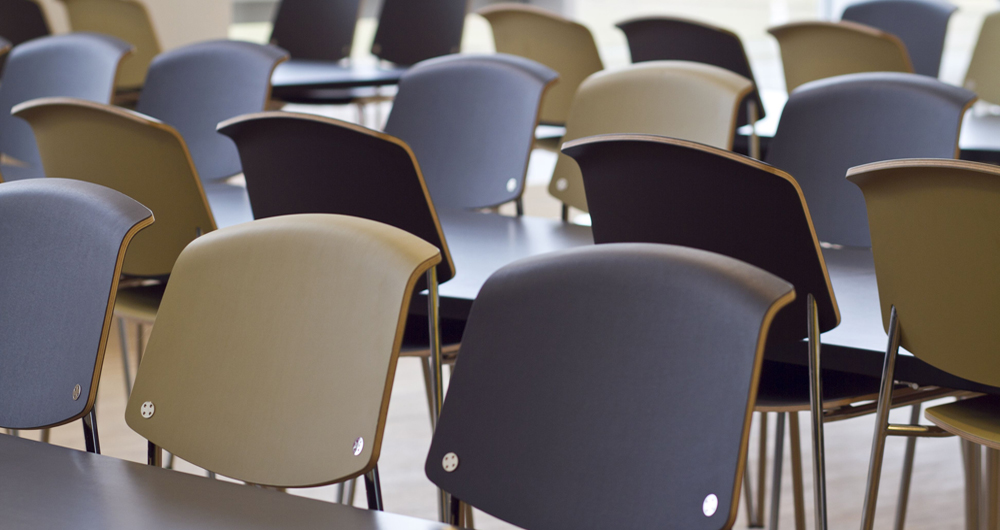
The image size is (1000, 530). Identify the location of table. (320, 76), (979, 132), (502, 238), (103, 487).